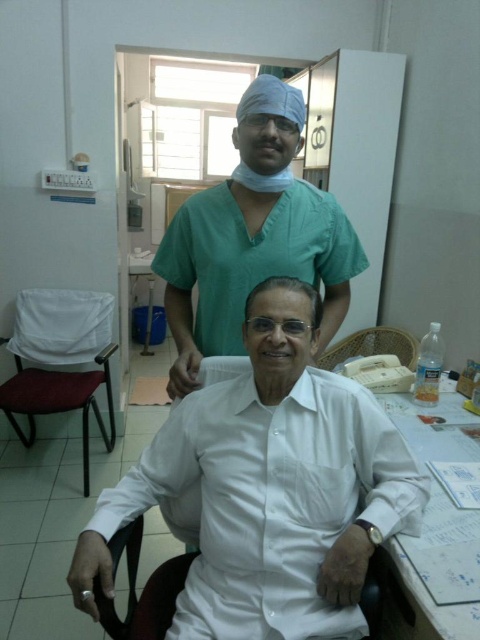
Which of these two, white smooth shirt at center or woven fabric chair at center, stands shorter?

Standing shorter between the two is woven fabric chair at center.

This screenshot has height=640, width=480. In order to click on white smooth shirt at center in this screenshot , I will do `click(268, 488)`.

Consider the image. Is white smooth shirt at center smaller than green scrubs at upper center?

No.

Measure the distance between point [248,348] and camera.

The distance of point [248,348] from camera is 1.17 meters.

Where is `white smooth shirt at center`? white smooth shirt at center is located at coordinates (268, 488).

Is green scrubs at upper center thinner than white fabric chair at left?

In fact, green scrubs at upper center might be wider than white fabric chair at left.

Consider the image. Can you confirm if green scrubs at upper center is bigger than white fabric chair at left?

No.

This screenshot has width=480, height=640. What are the coordinates of `green scrubs at upper center` in the screenshot? It's located at (252, 236).